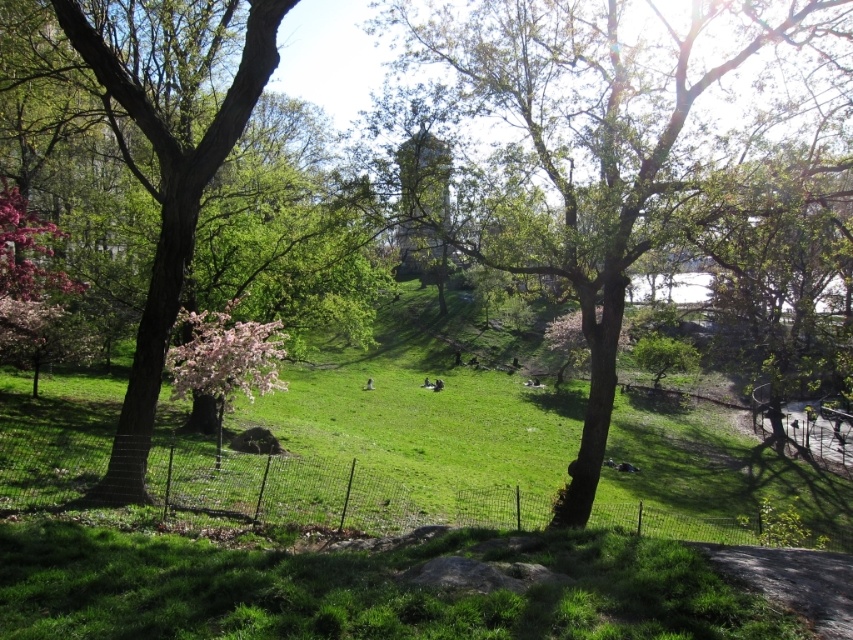
Question: Does green leafy tree at center have a larger size compared to smooth brown tree trunk at left?

Choices:
 (A) yes
 (B) no

Answer: (A)

Question: Which of the following is the farthest from the observer?

Choices:
 (A) (120, 454)
 (B) (607, 3)

Answer: (B)

Question: Does green leafy tree at center have a smaller size compared to smooth brown tree trunk at left?

Choices:
 (A) yes
 (B) no

Answer: (B)

Question: Is green leafy tree at center wider than smooth brown tree trunk at left?

Choices:
 (A) yes
 (B) no

Answer: (A)

Question: Which of the following is the closest to the observer?

Choices:
 (A) (231, 129)
 (B) (502, 256)

Answer: (A)

Question: Which object appears farthest from the camera in this image?

Choices:
 (A) smooth brown tree trunk at left
 (B) green leafy tree at center

Answer: (B)